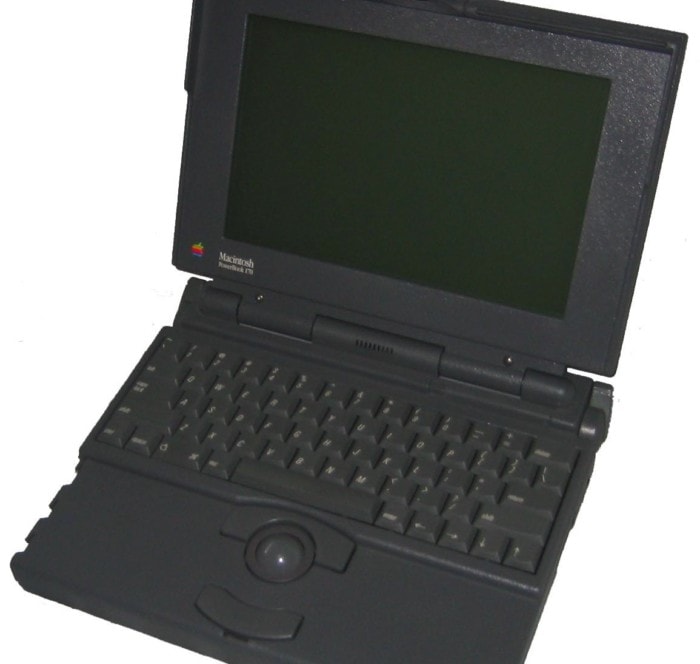
The height and width of the screenshot is (664, 700). I want to click on vents, so point(365,346), point(384,350).